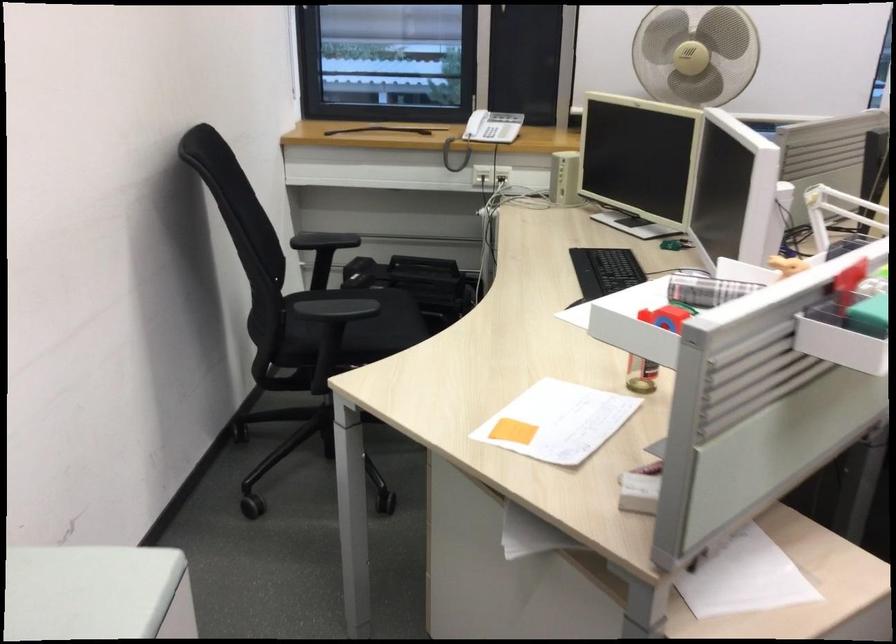
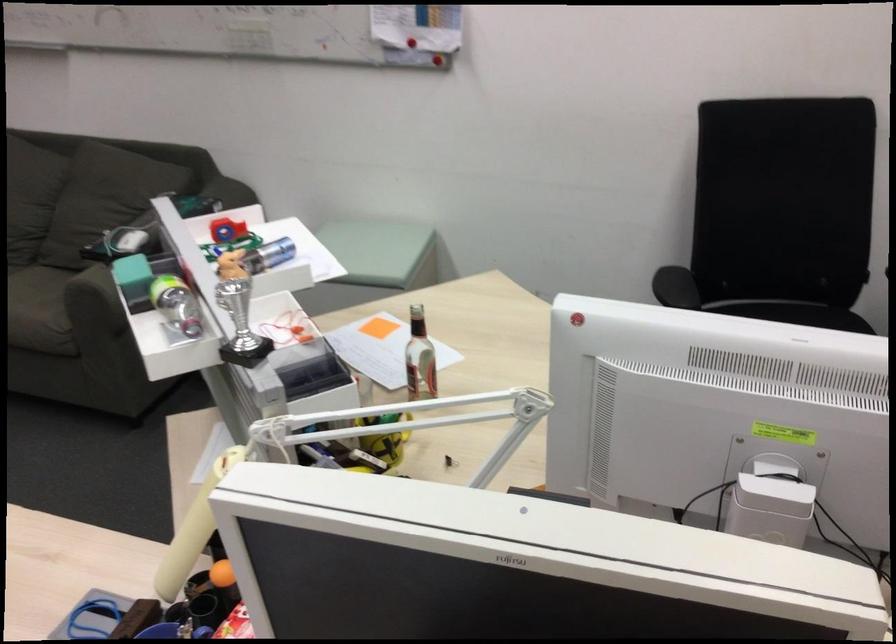
Where in the second image is the point corresponding to point 778,324 from the first image?

(240, 324)